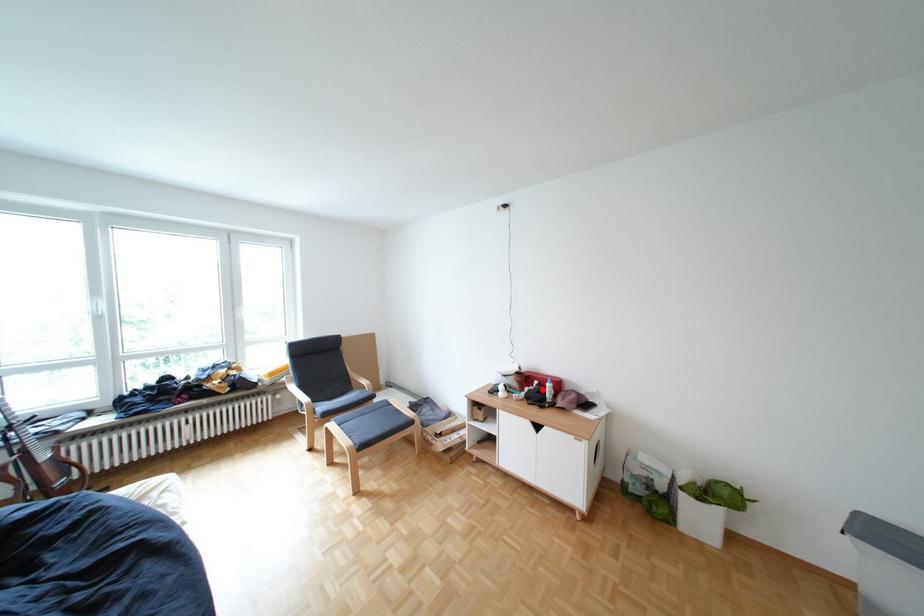
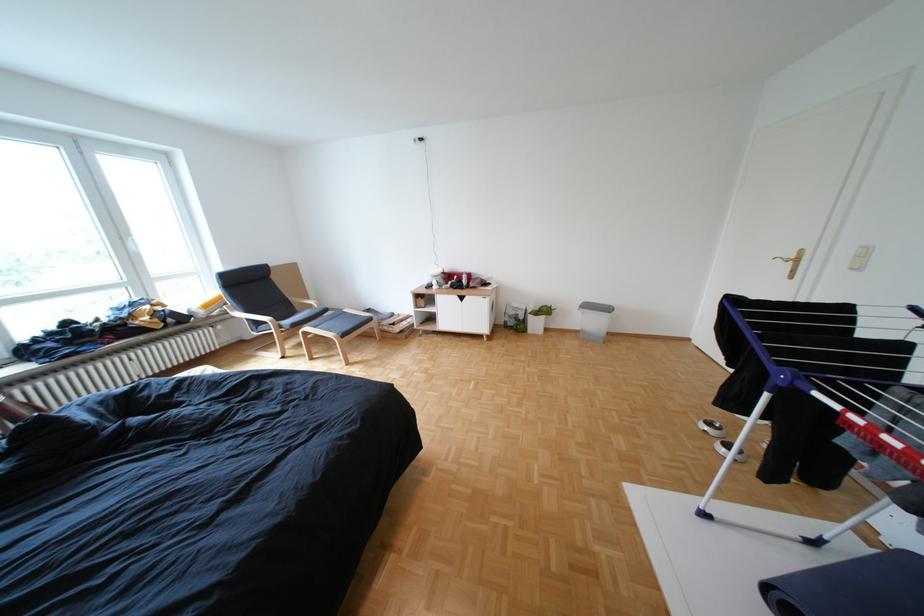
Find the pixel in the second image that matches the highlighted location in the first image.

(466, 283)